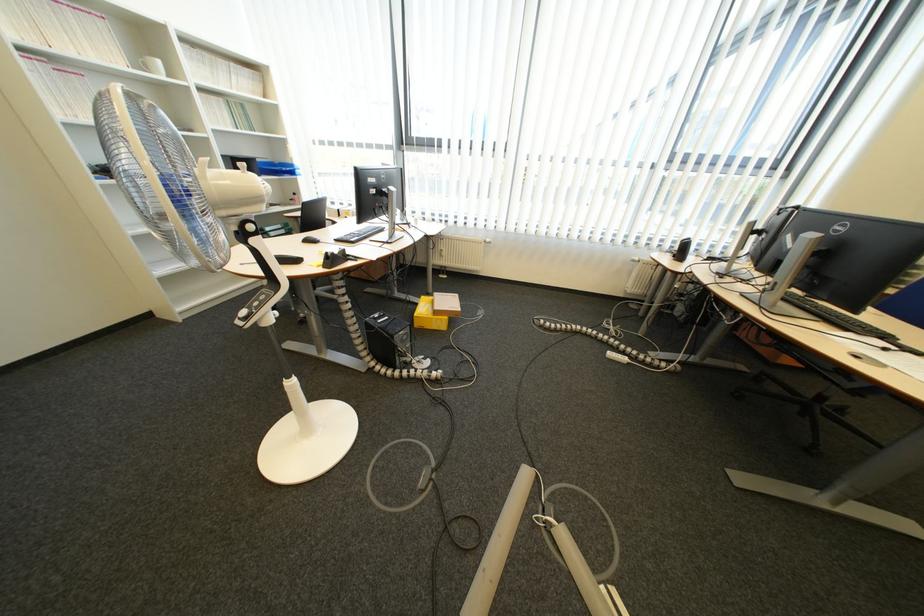
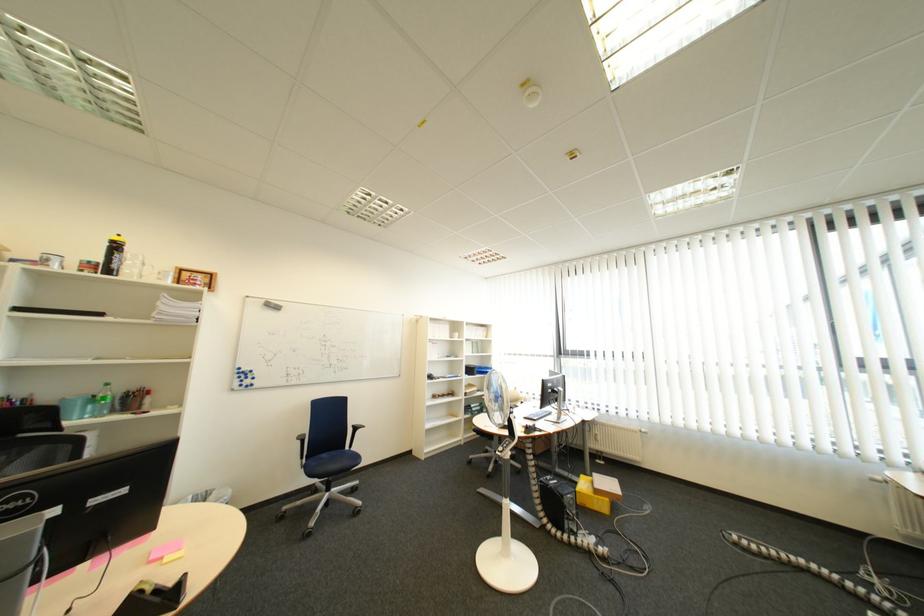
Locate, in the second image, the point that corresponds to (x=418, y=339) in the first image.

(585, 503)